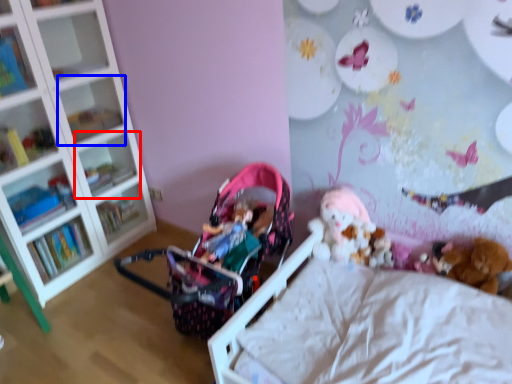
Question: Which object appears farthest to the camera in this image, shelf (highlighted by a red box) or shelf (highlighted by a blue box)?

Choices:
 (A) shelf
 (B) shelf

Answer: (A)